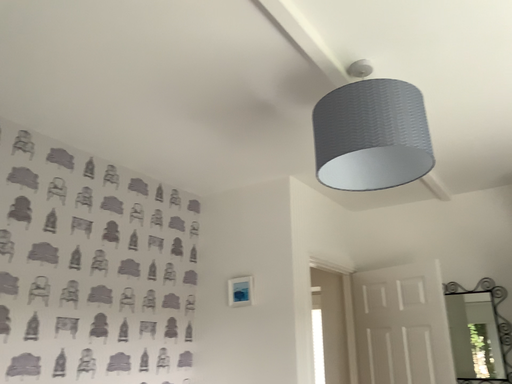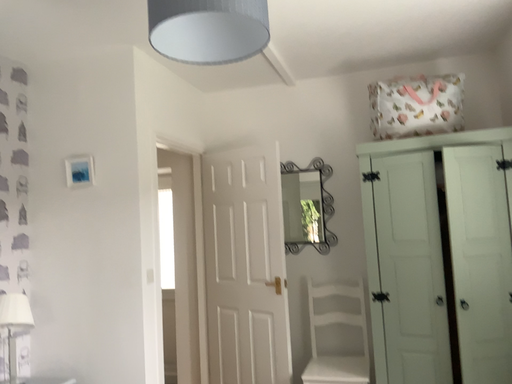
Question: Which way did the camera rotate in the video?

Choices:
 (A) rotated downward
 (B) rotated upward

Answer: (A)